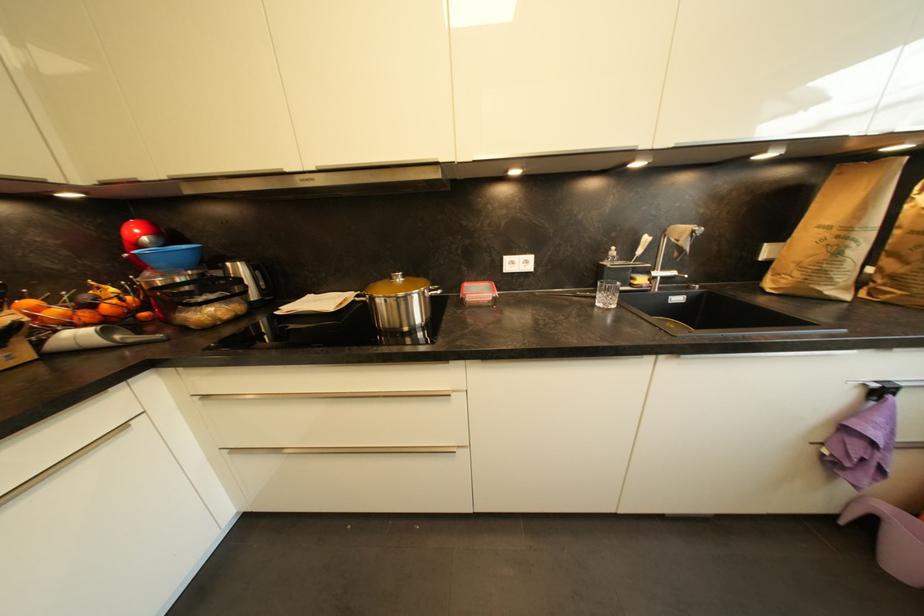
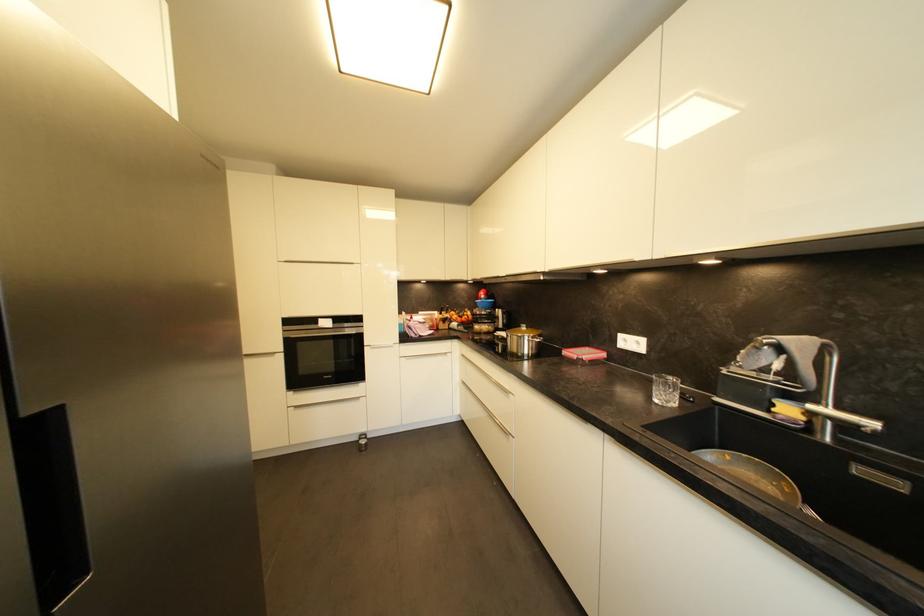
The point at (480, 283) is marked in the first image. Where is the corresponding point in the second image?

(602, 350)